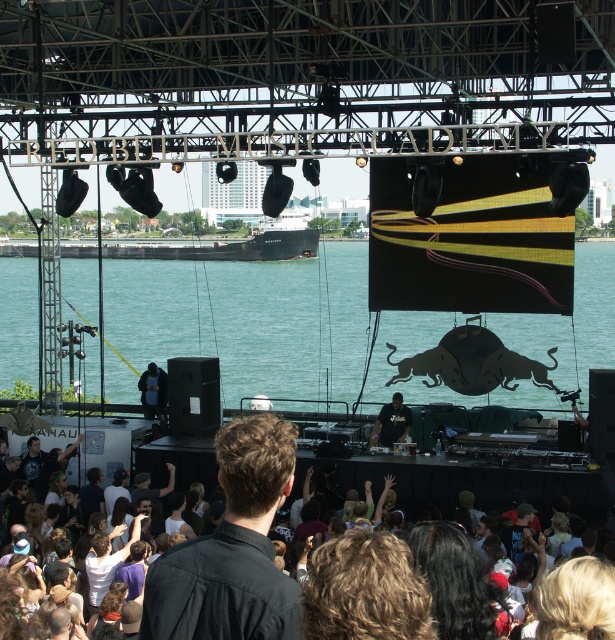
Consider the image. You are a photographer at the event and need to capture a clear shot of both the black matte shirt at center and the dark blue fabric at center. Which object should you focus on first to ensure both are in frame without moving the camera?

You should focus on the black matte shirt at center first because it is wider than the dark blue fabric at center, so centering it first ensures both will fit in the frame.

You are a photographer at the Red Bull Music Academy event. You want to take a photo that includes both the green water at center and the dark blue fabric at center. Which object will appear larger in your photo?

The green water at center will appear larger in the photo because it is closer to the viewer than the dark blue fabric at center.

You are standing at the DJ booth and want to move towards the point that is closer to you. Which point should you move towards, point (221, 356) or point (403, 429)?

Point (221, 356) is further to the viewer than point (403, 429). Therefore, you should move towards point (403, 429) since it is closer to you.